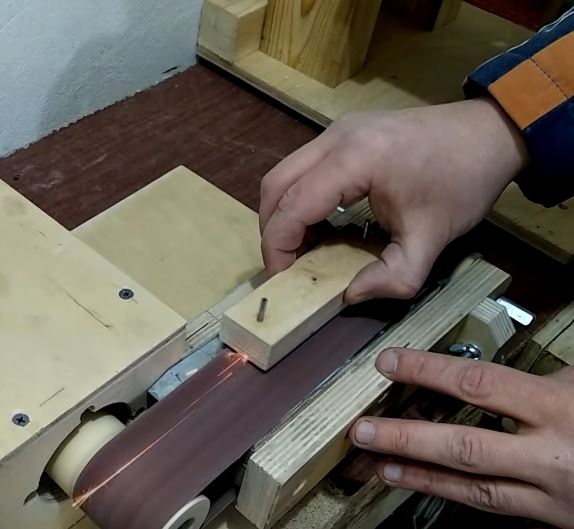
The width and height of the screenshot is (574, 529). I want to click on bluish wall of workshop, so click(x=93, y=77).